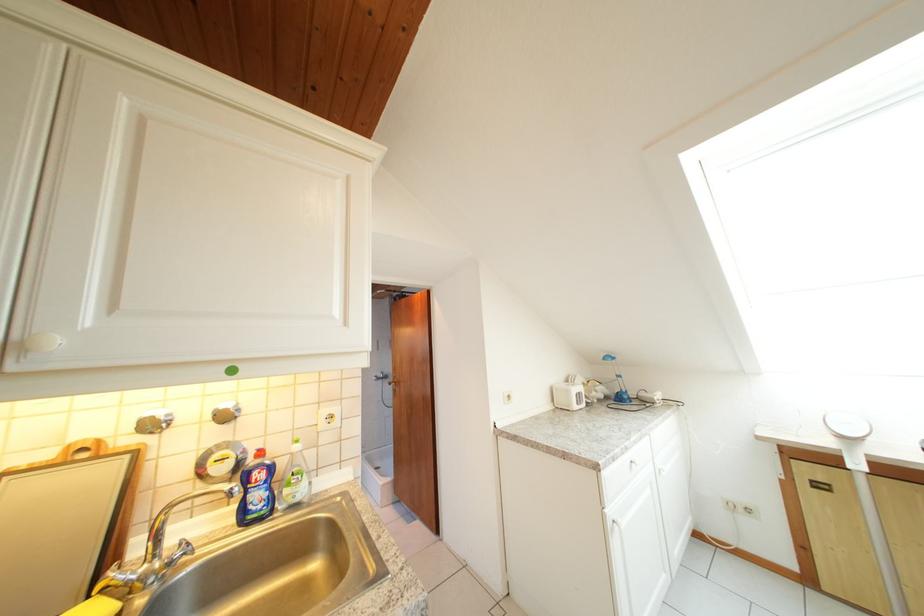
Describe the element at coordinates (49, 342) in the screenshot. The height and width of the screenshot is (616, 924). I see `the white cabinet knob` at that location.